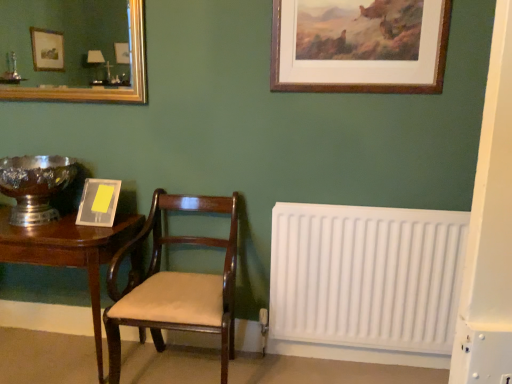
Locate an element on the screen. The image size is (512, 384). vacant space in white plastic radiator at lower right (from a real-world perspective) is located at coordinates (371, 367).